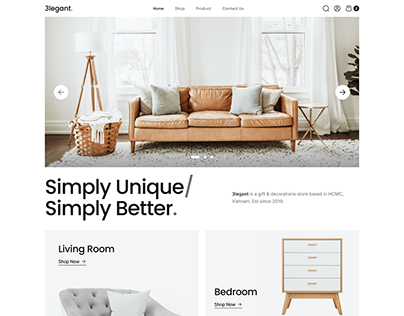
Locate an element on the screen. pillow is located at coordinates (128, 304).